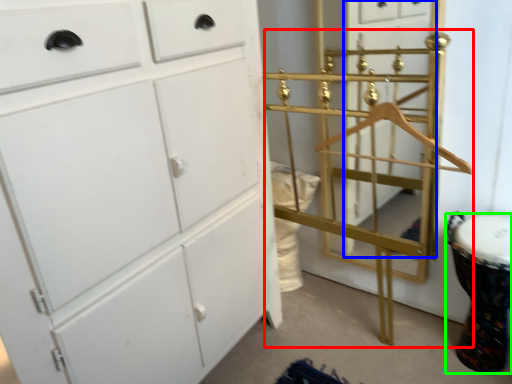
Question: Which object is the closest to the bunk bed (highlighted by a red box)? Choose among these: glass door (highlighted by a blue box) or drum (highlighted by a green box).

Choices:
 (A) glass door
 (B) drum

Answer: (A)